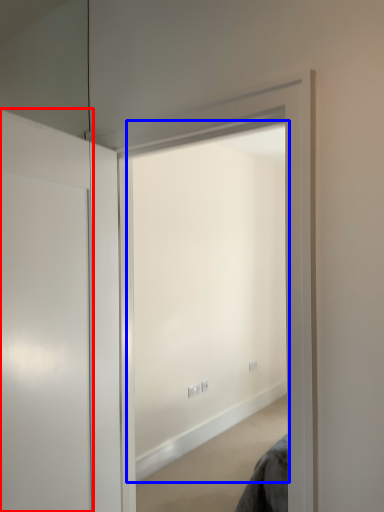
Question: Which object is closer to the camera taking this photo, door (highlighted by a red box) or window (highlighted by a blue box)?

Choices:
 (A) door
 (B) window

Answer: (A)